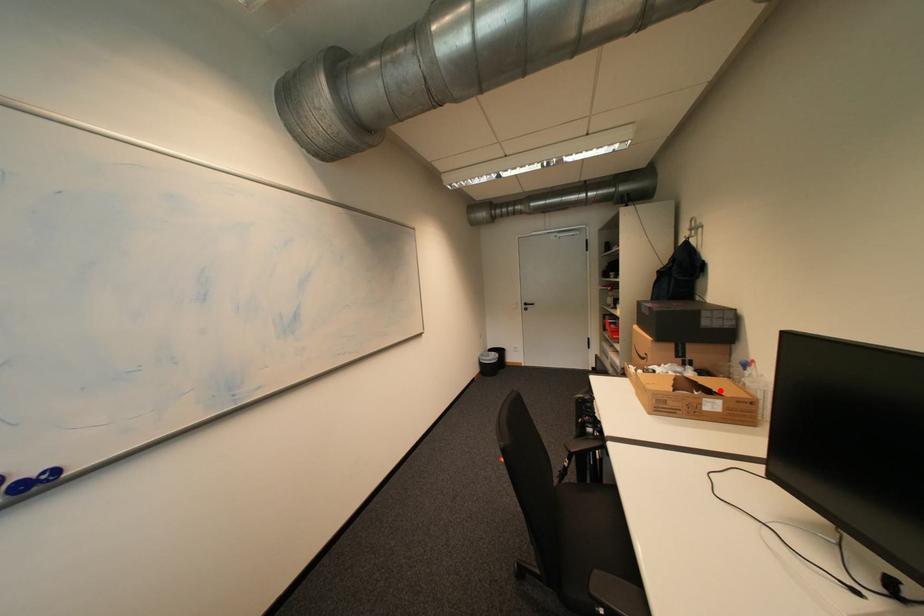
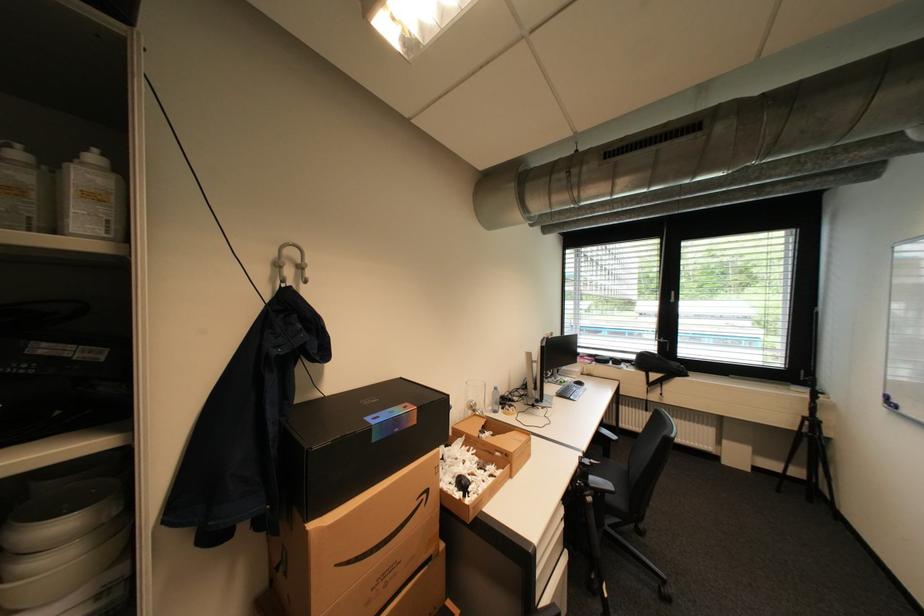
Where in the second image is the point corresponding to the highlighted location from the first image?

(492, 426)